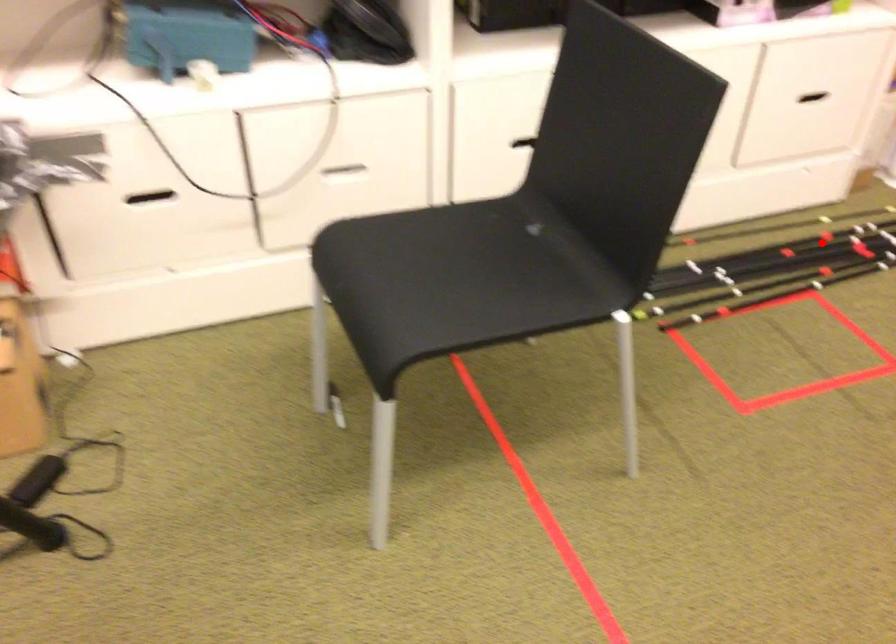
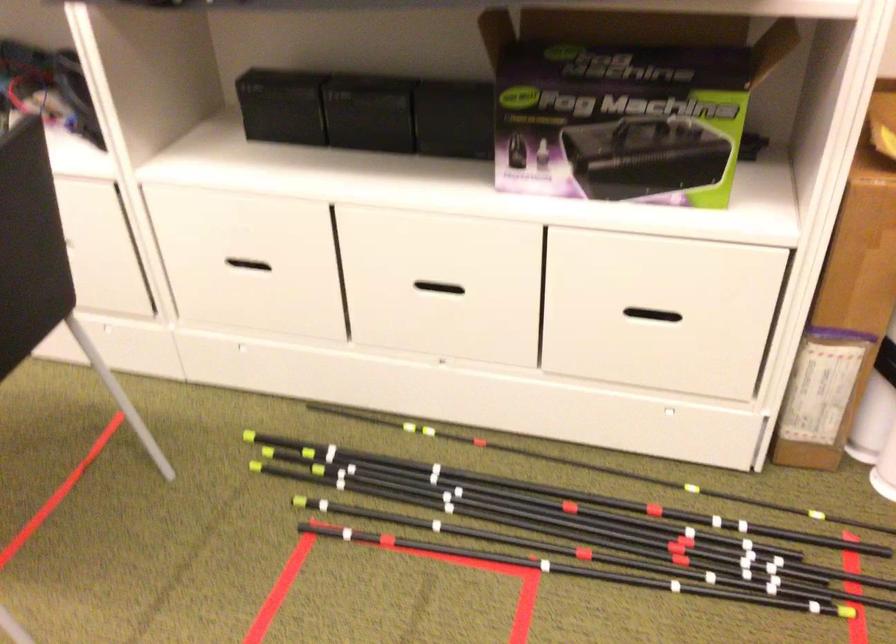
Where in the second image is the point corresponding to the highlighted location from the first image?

(638, 524)